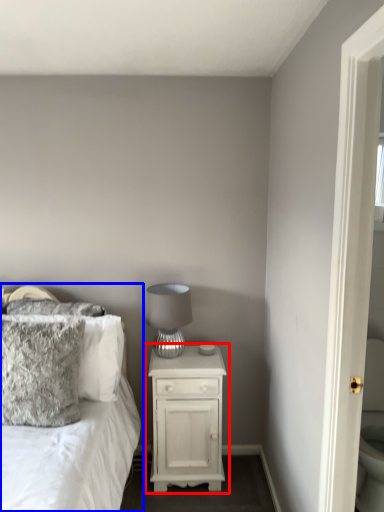
Question: Which object is further to the camera taking this photo, nightstand (highlighted by a red box) or bed (highlighted by a blue box)?

Choices:
 (A) nightstand
 (B) bed

Answer: (A)